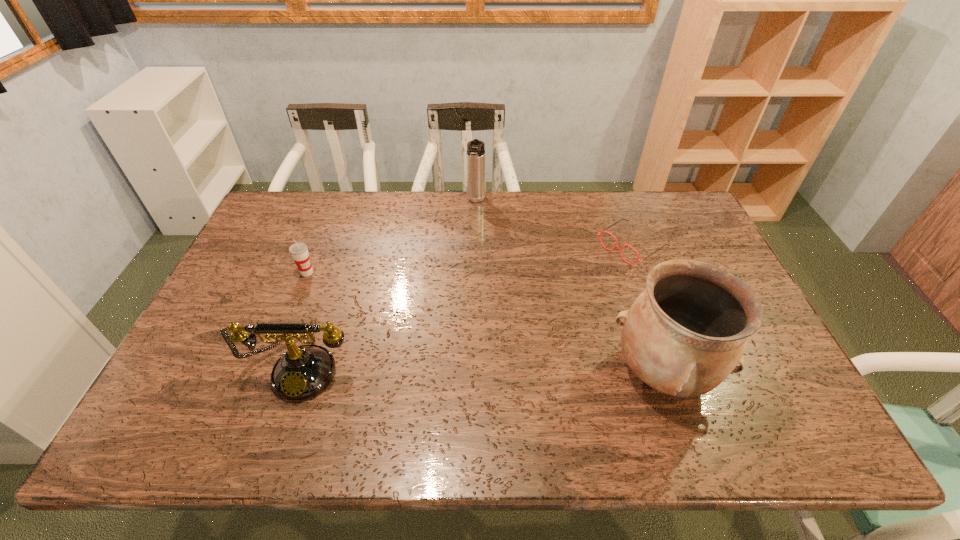
Where is `vacant area that satisfies the following two spatial constraints: 1. on the back side of the third object from left to right; 2. on the left side of the cup`? The width and height of the screenshot is (960, 540). vacant area that satisfies the following two spatial constraints: 1. on the back side of the third object from left to right; 2. on the left side of the cup is located at coordinates (336, 201).